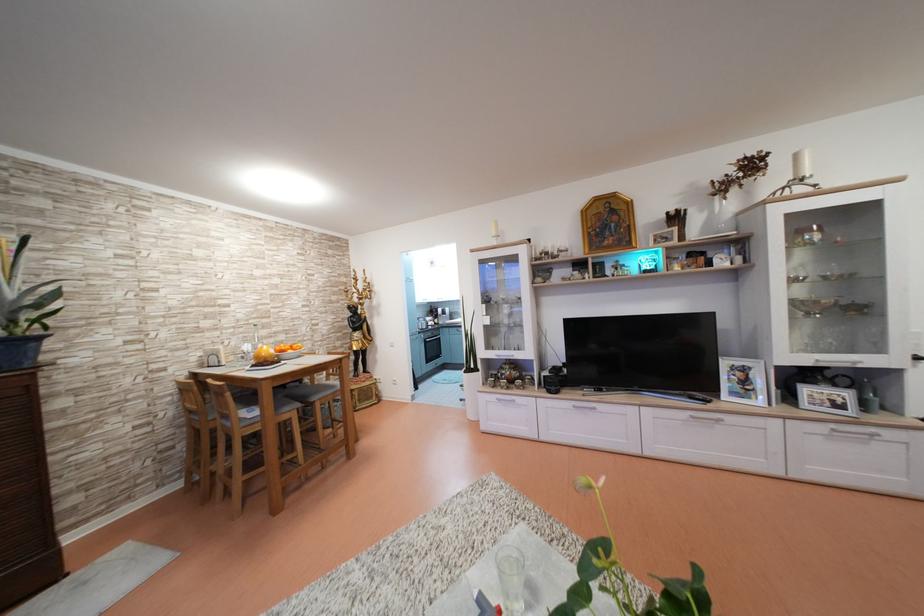
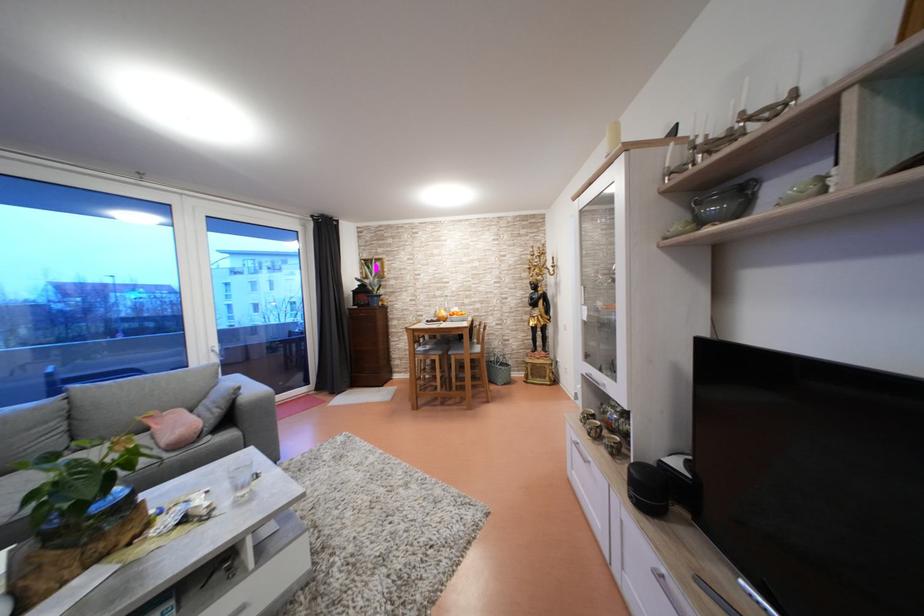
In the second image, find the point that corresponds to point 201,363 in the first image.

(440, 318)